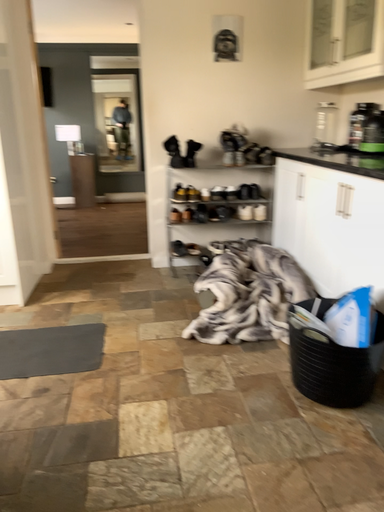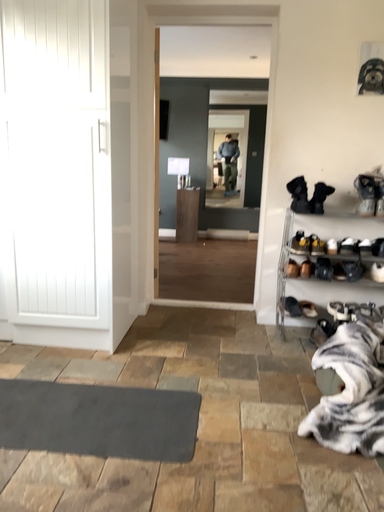
Question: How did the camera likely rotate when shooting the video?

Choices:
 (A) rotated left
 (B) rotated right

Answer: (A)